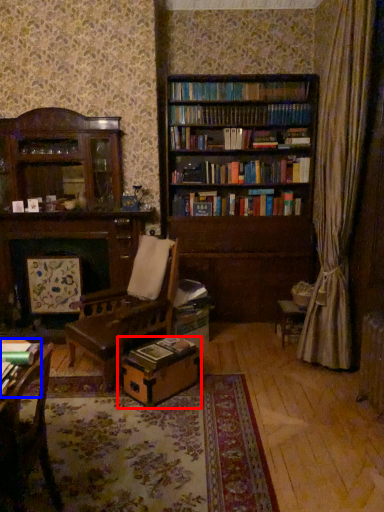
Question: Which object is closer to the camera taking this photo, cardboard box (highlighted by a red box) or book (highlighted by a blue box)?

Choices:
 (A) cardboard box
 (B) book

Answer: (B)